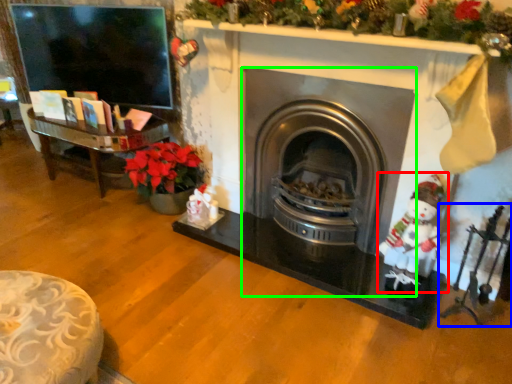
Question: Based on their relative distances, which object is nearer to santa claus (highlighted by a red box)? Choose from toy (highlighted by a blue box) and wood burning stove (highlighted by a green box).

Choices:
 (A) toy
 (B) wood burning stove

Answer: (A)